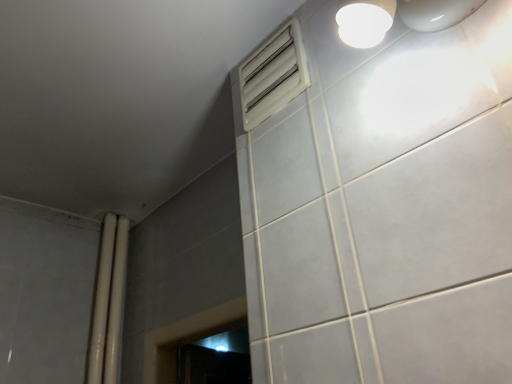
At what (x,y) coordinates should I click in order to perform the action: click on white plastic air conditioning at upper center. Please return your answer as a coordinate pair (x, y). Looking at the image, I should click on (273, 76).

What do you see at coordinates (273, 76) in the screenshot? I see `white plastic air conditioning at upper center` at bounding box center [273, 76].

Where is `white plastic air conditioning at upper center`? This screenshot has width=512, height=384. white plastic air conditioning at upper center is located at coordinates (273, 76).